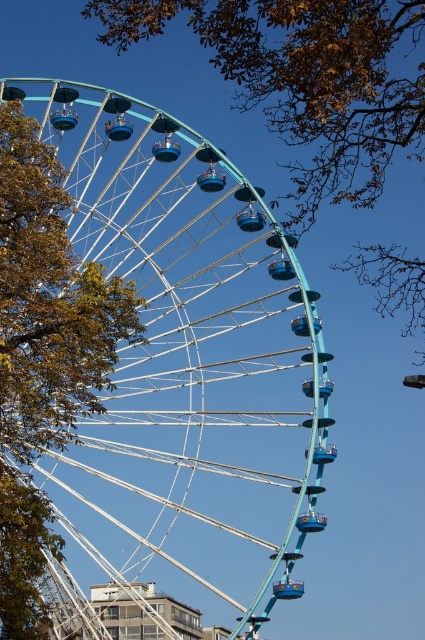
Can you confirm if teal metallic ferris wheel at center is shorter than green leafy tree at left?

No, teal metallic ferris wheel at center is not shorter than green leafy tree at left.

Who is lower down, teal metallic ferris wheel at center or green leafy tree at left?

Positioned lower is green leafy tree at left.

Identify the location of teal metallic ferris wheel at center. (187, 364).

I want to click on teal metallic ferris wheel at center, so click(x=187, y=364).

Who is positioned more to the left, brown leafy tree at upper center or green leafy tree at left?

Positioned to the left is green leafy tree at left.

Can you confirm if brown leafy tree at upper center is smaller than green leafy tree at left?

No.

The image size is (425, 640). In order to click on brown leafy tree at upper center in this screenshot , I will do `click(306, 80)`.

Which of these two, teal metallic ferris wheel at center or brown leafy tree at upper center, stands shorter?

brown leafy tree at upper center is shorter.

Does teal metallic ferris wheel at center appear on the right side of brown leafy tree at upper center?

In fact, teal metallic ferris wheel at center is to the left of brown leafy tree at upper center.

What do you see at coordinates (187, 364) in the screenshot? I see `teal metallic ferris wheel at center` at bounding box center [187, 364].

This screenshot has height=640, width=425. I want to click on teal metallic ferris wheel at center, so click(x=187, y=364).